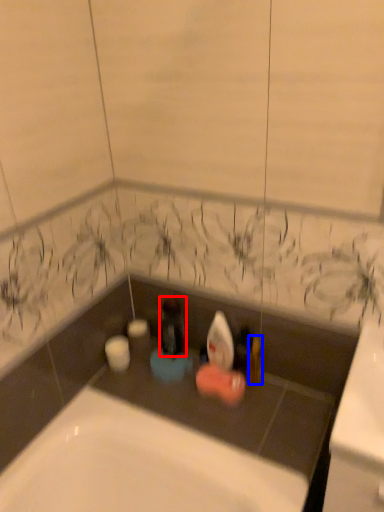
Question: Which object appears farthest to the camera in this image, bottle (highlighted by a red box) or toiletry (highlighted by a blue box)?

Choices:
 (A) bottle
 (B) toiletry

Answer: (A)